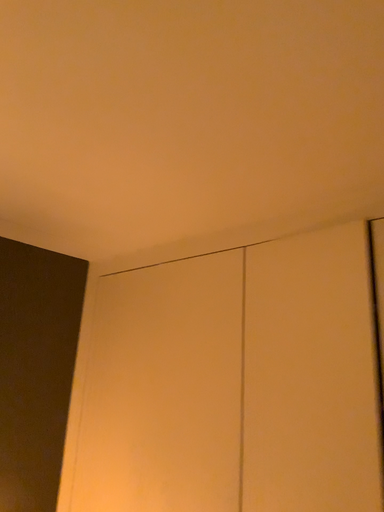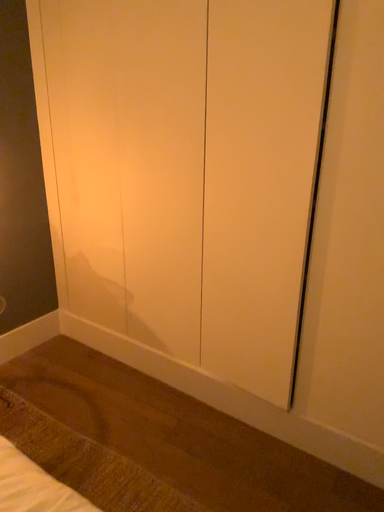
Question: How did the camera likely rotate when shooting the video?

Choices:
 (A) rotated right
 (B) rotated left

Answer: (A)